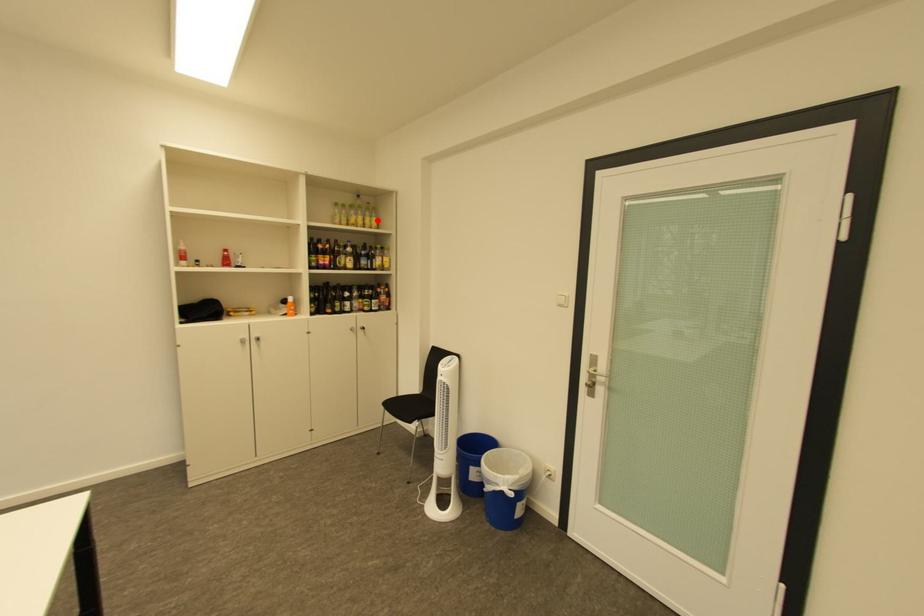
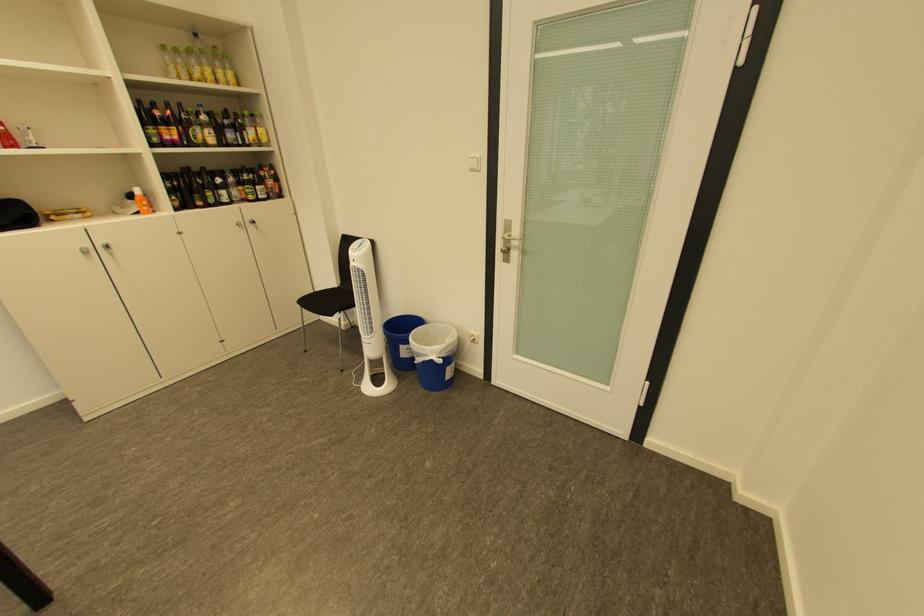
Where in the second image is the point corresponding to the highlighted location from the first image?

(228, 73)